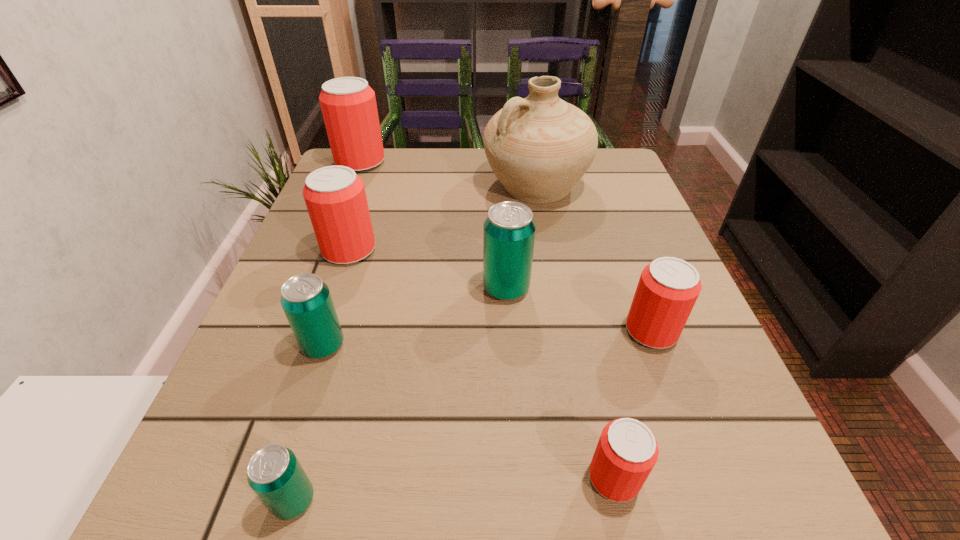
You are a GUI agent. You are given a task and a screenshot of the screen. Output one action in this format:
    pyautogui.click(x=<x>, y=<y>)
    Task: Click on the vacant space at the left edge of the desktop
    
    Given the screenshot: What is the action you would take?
    pyautogui.click(x=270, y=351)

Find the location of `vacant space at the right edge of the desktop`. vacant space at the right edge of the desktop is located at coordinates (637, 367).

What are the coordinates of `free spot at the far left corner of the desktop` in the screenshot? It's located at (364, 174).

Image resolution: width=960 pixels, height=540 pixels. I want to click on free space at the far right corner of the desktop, so (x=615, y=160).

This screenshot has width=960, height=540. I want to click on unoccupied position between the sixth nearest object and the pottery, so click(443, 218).

You are a GUI agent. You are given a task and a screenshot of the screen. Output one action in this format:
    pyautogui.click(x=<x>, y=<y>)
    Task: Click on the vacant area that lies between the farthest teal beer can and the nearest teal beer can
    This screenshot has width=960, height=540.
    Given the screenshot: What is the action you would take?
    pyautogui.click(x=400, y=394)

Identify the location of vacant area that lies between the second biggest teal beer can and the rightmost teal beer can. The width and height of the screenshot is (960, 540). (415, 317).

This screenshot has width=960, height=540. What are the coordinates of `free space that is in between the second smallest teal beer can and the pottery` in the screenshot? It's located at (429, 266).

This screenshot has height=540, width=960. I want to click on free space between the second red beer can from right to left and the second biggest teal beer can, so 468,411.

Locate an element on the screen. The width and height of the screenshot is (960, 540). empty space that is in between the second nearest red beer can and the nearest teal beer can is located at coordinates (472, 415).